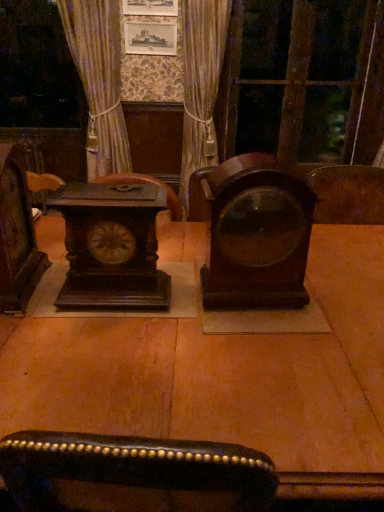
Where is `vacant region in front of mahogany wood alarm clock at center, the 2th alarm clock positioned from the left`? This screenshot has height=512, width=384. vacant region in front of mahogany wood alarm clock at center, the 2th alarm clock positioned from the left is located at coordinates (264, 337).